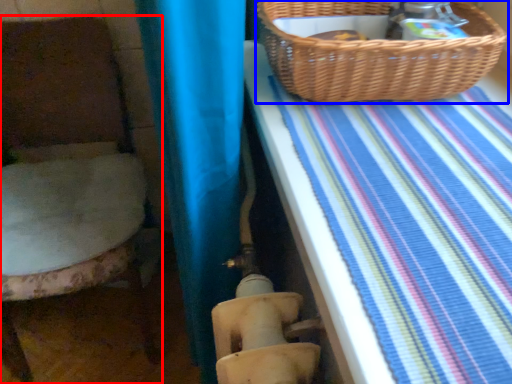
Question: Which object is further to the camera taking this photo, furniture (highlighted by a red box) or picnic basket (highlighted by a blue box)?

Choices:
 (A) furniture
 (B) picnic basket

Answer: (A)